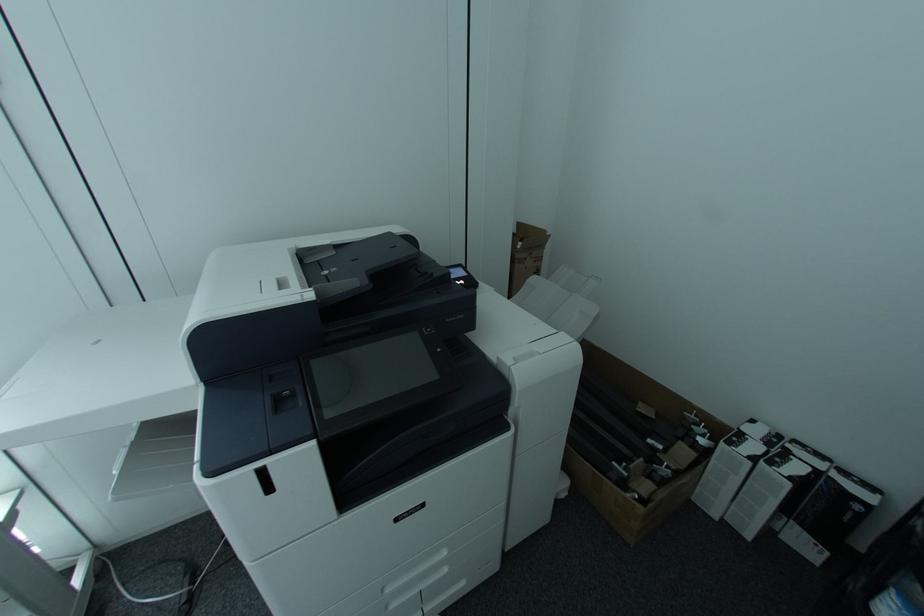
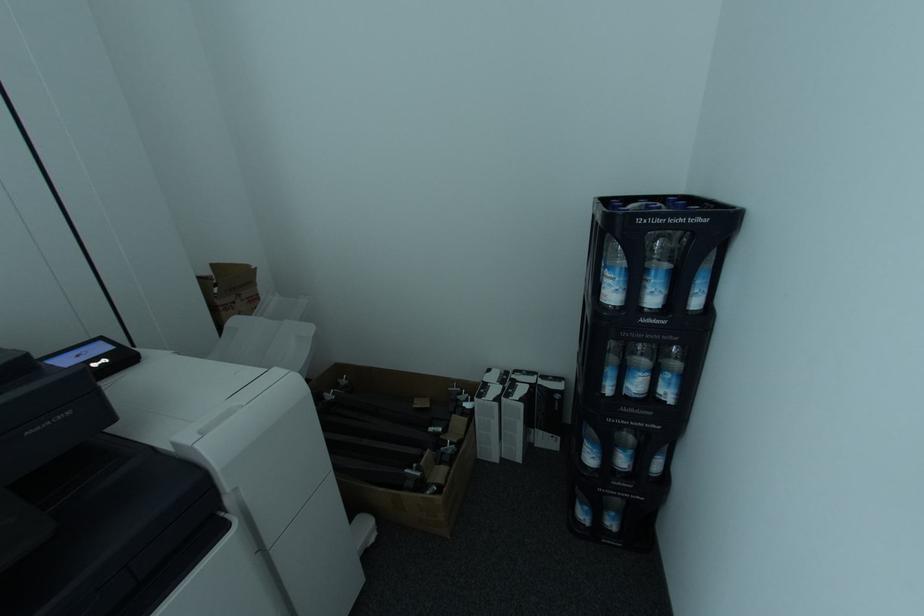
Question: Based on the continuous images, in which direction is the camera rotating? Reply with the corresponding letter.

Choices:
 (A) Left
 (B) Right
 (C) Up
 (D) Down

Answer: (B)